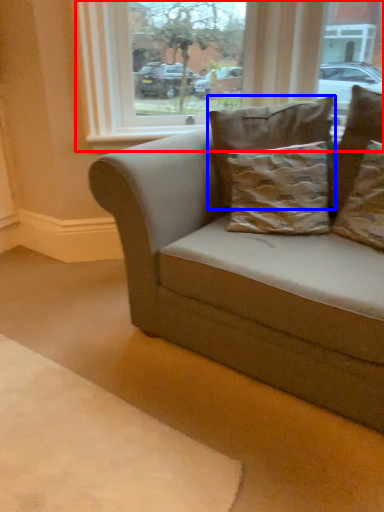
Question: Which object appears closest to the camera in this image, window (highlighted by a red box) or pillow (highlighted by a blue box)?

Choices:
 (A) window
 (B) pillow

Answer: (B)